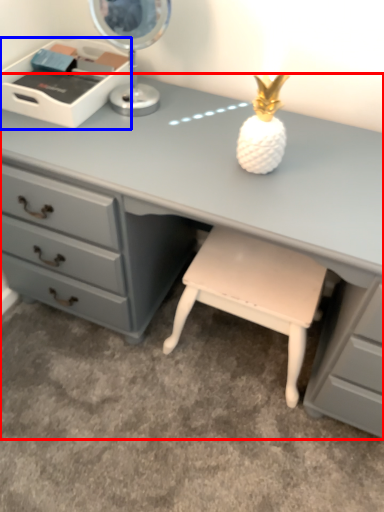
Question: Which object appears farthest to the camera in this image, desk (highlighted by a red box) or writing desk (highlighted by a blue box)?

Choices:
 (A) desk
 (B) writing desk

Answer: (B)